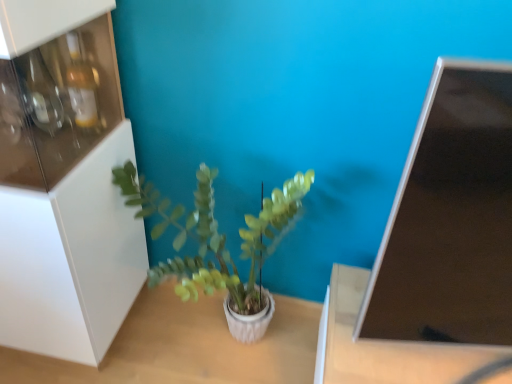
Question: Considering the relative positions of brown matte table at lower right, which is the first table in right-to-left order, and matte black monitor at upper right in the image provided, is brown matte table at lower right, which is the first table in right-to-left order, to the right of matte black monitor at upper right from the viewer's perspective?

Choices:
 (A) no
 (B) yes

Answer: (B)

Question: Is brown matte table at lower right, which is counted as the second table, starting from the left, closer to the viewer compared to matte black monitor at upper right?

Choices:
 (A) yes
 (B) no

Answer: (B)

Question: Is brown matte table at lower right, which is counted as the second table, starting from the left, smaller than matte black monitor at upper right?

Choices:
 (A) yes
 (B) no

Answer: (B)

Question: Can you confirm if brown matte table at lower right, which is counted as the second table, starting from the left, is thinner than matte black monitor at upper right?

Choices:
 (A) no
 (B) yes

Answer: (A)

Question: Is brown matte table at lower right, which is the first table in right-to-left order, far away from matte black monitor at upper right?

Choices:
 (A) no
 (B) yes

Answer: (A)

Question: In the image, is white glossy cabinet at left positioned in front of or behind white textured table at center, which ranks as the first table in left-to-right order?

Choices:
 (A) front
 (B) behind

Answer: (A)

Question: Looking at their shapes, would you say white glossy cabinet at left is wider or thinner than white textured table at center, which ranks as the first table in left-to-right order?

Choices:
 (A) wide
 (B) thin

Answer: (B)

Question: Is white glossy cabinet at left taller or shorter than white textured table at center, which ranks as the first table in left-to-right order?

Choices:
 (A) short
 (B) tall

Answer: (B)

Question: Is white glossy cabinet at left bigger or smaller than white textured table at center, which ranks as the first table in left-to-right order?

Choices:
 (A) big
 (B) small

Answer: (A)

Question: Considering the positions of matte black monitor at upper right and brown matte table at lower right, which is the first table in right-to-left order, in the image, is matte black monitor at upper right bigger or smaller than brown matte table at lower right, which is the first table in right-to-left order,?

Choices:
 (A) small
 (B) big

Answer: (A)

Question: Does point (448, 292) appear closer or farther from the camera than point (333, 294)?

Choices:
 (A) closer
 (B) farther

Answer: (A)

Question: Looking at their shapes, would you say matte black monitor at upper right is wider or thinner than brown matte table at lower right, which is counted as the second table, starting from the left?

Choices:
 (A) wide
 (B) thin

Answer: (B)

Question: In the image, is matte black monitor at upper right positioned in front of or behind brown matte table at lower right, which is counted as the second table, starting from the left?

Choices:
 (A) behind
 (B) front

Answer: (B)

Question: Would you say white glossy cabinet at left is inside or outside green matte plant at center?

Choices:
 (A) outside
 (B) inside

Answer: (A)

Question: In terms of width, does white glossy cabinet at left look wider or thinner when compared to green matte plant at center?

Choices:
 (A) wide
 (B) thin

Answer: (A)